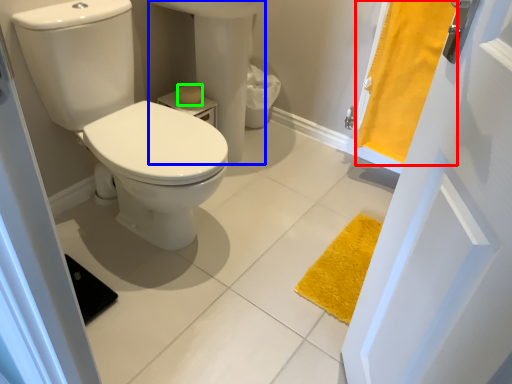
Question: Considering the real-world distances, which object is closest to curtain (highlighted by a red box)? sink (highlighted by a blue box) or toilet paper (highlighted by a green box).

Choices:
 (A) sink
 (B) toilet paper

Answer: (A)